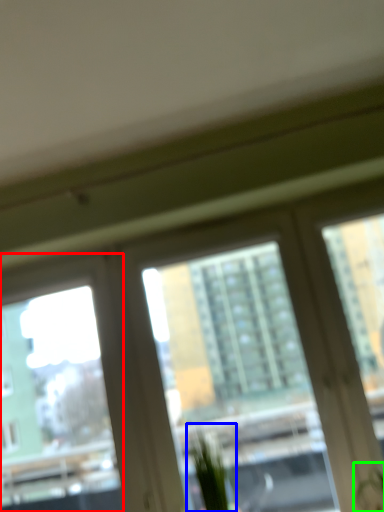
Question: Considering the real-world distances, which object is closest to window screen (highlighted by a red box)? plant (highlighted by a blue box) or plant (highlighted by a green box).

Choices:
 (A) plant
 (B) plant

Answer: (A)